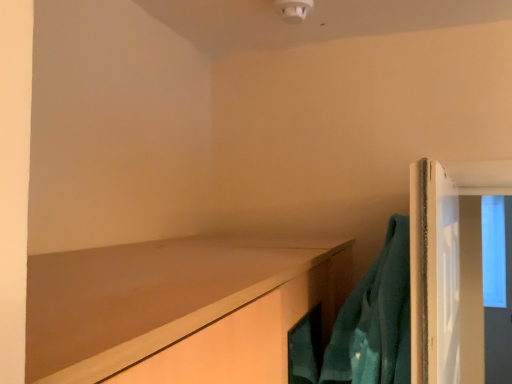
Image resolution: width=512 pixels, height=384 pixels. Identify the location of teal fabric robe at right. (375, 320).

Describe the element at coordinates (375, 320) in the screenshot. This screenshot has height=384, width=512. I see `teal fabric robe at right` at that location.

The height and width of the screenshot is (384, 512). What are the coordinates of `teal fabric robe at right` in the screenshot? It's located at (375, 320).